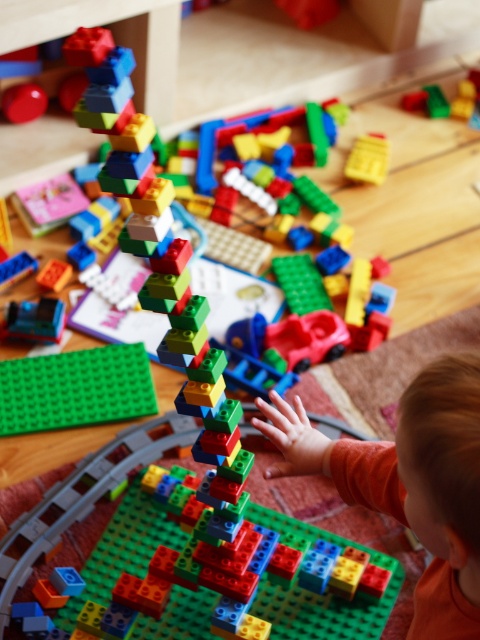
How distant is orange soft baby at center from green matte baseplate at center?

orange soft baby at center is 25.39 inches from green matte baseplate at center.

Can you confirm if orange soft baby at center is positioned below green matte baseplate at center?

Yes, orange soft baby at center is below green matte baseplate at center.

Who is more forward, (271, 465) or (148, 376)?

Point (271, 465)

Locate an element on the screen. The image size is (480, 640). orange soft baby at center is located at coordinates (409, 483).